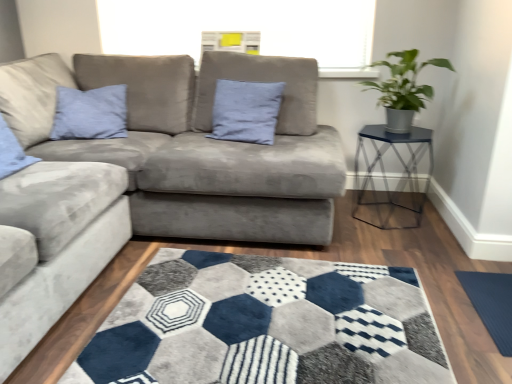
Question: Visually, is green matte plant at upper right positioned to the left or to the right of dark blue textured yoga mat at lower right?

Choices:
 (A) left
 (B) right

Answer: (A)

Question: In the image, is green matte plant at upper right positioned in front of or behind dark blue textured yoga mat at lower right?

Choices:
 (A) front
 (B) behind

Answer: (B)

Question: Which is nearer to the suede blue pillow at center?

Choices:
 (A) metal hexagonal table at right
 (B) green matte plant at upper right
 (C) dark blue textured yoga mat at lower right
 (D) suede couch at center

Answer: (D)

Question: Which of these objects is positioned farthest from the metal hexagonal table at right?

Choices:
 (A) suede couch at center
 (B) suede blue pillow at center
 (C) green matte plant at upper right
 (D) dark blue textured yoga mat at lower right

Answer: (A)